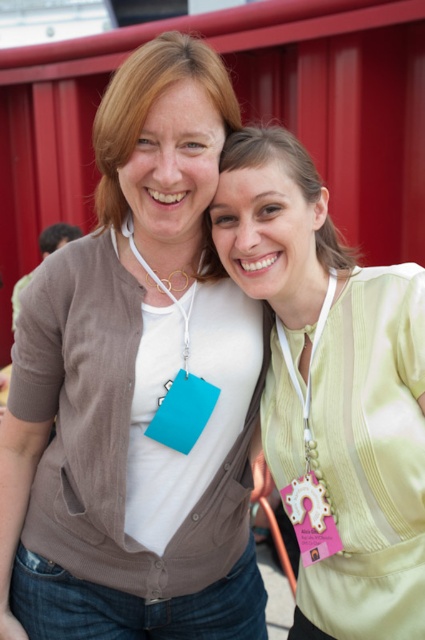
Does pink fabric badge at right appear over teal plastic lanyard at center?

Incorrect, pink fabric badge at right is not positioned above teal plastic lanyard at center.

Is point (314, 548) in front of point (198, 387)?

Yes, point (314, 548) is closer to viewer.

Where is `pink fabric badge at right`? This screenshot has width=425, height=640. pink fabric badge at right is located at coordinates (309, 461).

In the scene shown: Does matte white shirt at center have a lesser height compared to teal plastic lanyard at center?

Incorrect, matte white shirt at center's height does not fall short of teal plastic lanyard at center's.

Is the position of matte white shirt at center more distant than that of teal plastic lanyard at center?

No, it is in front of teal plastic lanyard at center.

This screenshot has width=425, height=640. Describe the element at coordinates (136, 387) in the screenshot. I see `matte white shirt at center` at that location.

Find the location of `matte white shirt at center`. matte white shirt at center is located at coordinates [x=136, y=387].

Does point (107, 378) lie behind point (362, 400)?

Yes, it is behind point (362, 400).

Where is `matte white shirt at center`? matte white shirt at center is located at coordinates (136, 387).

Identify the location of matte white shirt at center. Image resolution: width=425 pixels, height=640 pixels. (136, 387).